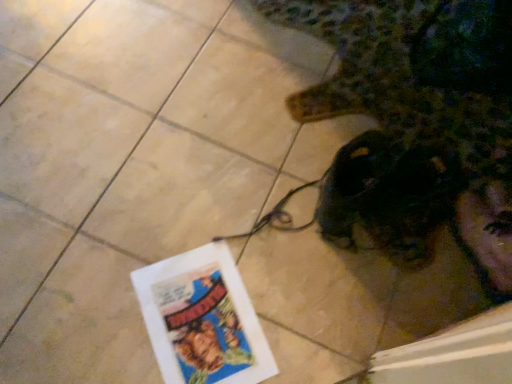
The width and height of the screenshot is (512, 384). In order to click on vacant space behind shiny black headphones at lower right in this screenshot , I will do `click(376, 103)`.